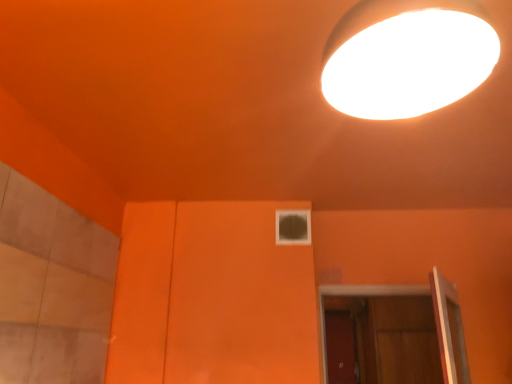
Question: Is point (338, 292) closer or farther from the camera than point (283, 228)?

Choices:
 (A) farther
 (B) closer

Answer: (A)

Question: From the image's perspective, is wooden at lower right above or below transparent glass window at center?

Choices:
 (A) below
 (B) above

Answer: (A)

Question: Which object is the closest to the wooden at lower right?

Choices:
 (A) white glossy lamp at upper right
 (B) transparent glass window at center

Answer: (B)

Question: Which object is the closest to the transparent glass window at center?

Choices:
 (A) wooden at lower right
 (B) white glossy lamp at upper right

Answer: (A)